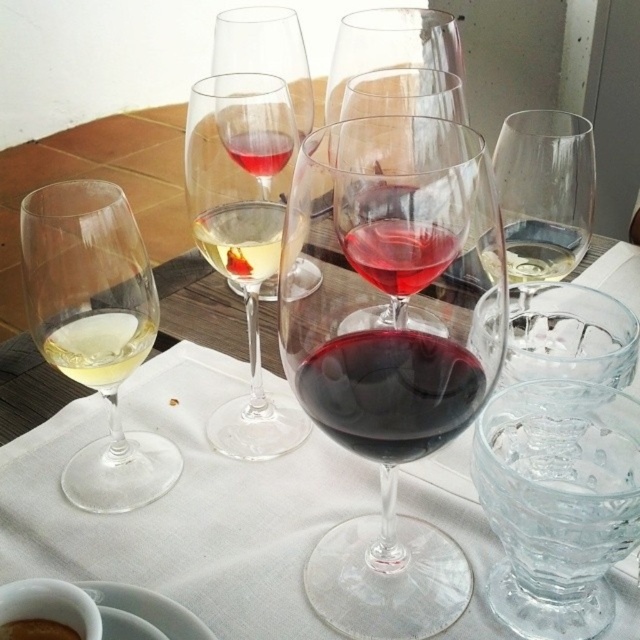
Is translucent glass wine glass at center above red glass wine at center?

Correct, translucent glass wine glass at center is located above red glass wine at center.

Who is more forward, [230,152] or [365,221]?

Point [365,221] is in front.

Is point (276, 108) less distant than point (387, 250)?

No, it is not.

Locate an element on the screen. This screenshot has width=640, height=640. translucent glass wine glass at center is located at coordinates (243, 230).

Does transparent glass wine glasses at center appear over white translucent glass at left?

Incorrect, transparent glass wine glasses at center is not positioned above white translucent glass at left.

Is point (493, 541) behind point (106, 316)?

That is True.

This screenshot has height=640, width=640. What do you see at coordinates (180, 547) in the screenshot? I see `transparent glass wine glasses at center` at bounding box center [180, 547].

Image resolution: width=640 pixels, height=640 pixels. I want to click on transparent glass wine glasses at center, so click(180, 547).

Looking at this image, can you confirm if translucent glass wine glass at center is positioned to the right of white opaque glass at center?

Incorrect, translucent glass wine glass at center is not on the right side of white opaque glass at center.

Does translucent glass wine glass at center appear over white opaque glass at center?

Incorrect, translucent glass wine glass at center is not positioned above white opaque glass at center.

The image size is (640, 640). Find the location of `translucent glass wine glass at center`. translucent glass wine glass at center is located at coordinates (243, 230).

The image size is (640, 640). In order to click on translucent glass wine glass at center in this screenshot , I will do pos(243,230).